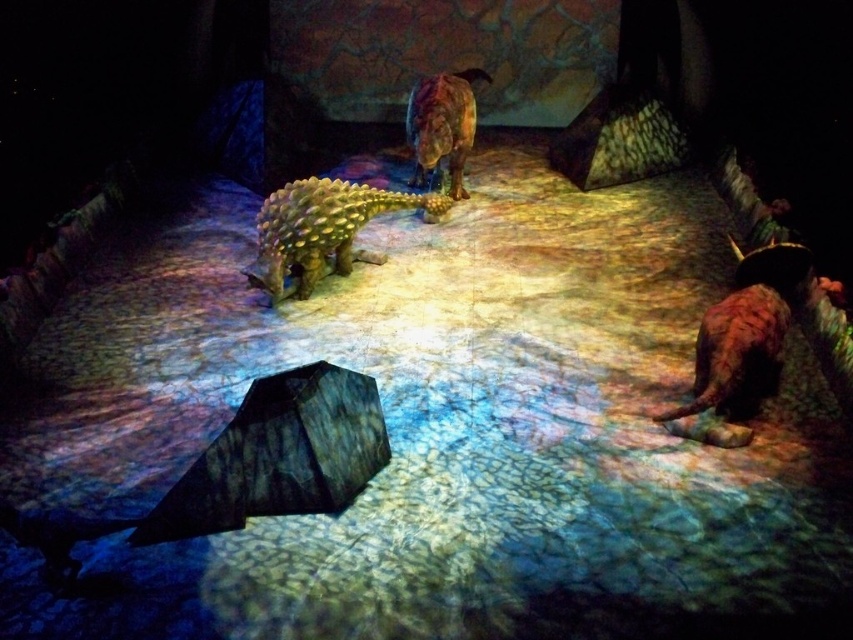
Question: Observing the image, what is the correct spatial positioning of green scaly ankylosaurus at center in reference to shiny brown dinosaur at center?

Choices:
 (A) right
 (B) left

Answer: (B)

Question: Where is green scaly ankylosaurus at center located in relation to shiny brown dinosaur at center in the image?

Choices:
 (A) right
 (B) left

Answer: (B)

Question: Based on their relative distances, which object is nearer to the green scaly ankylosaurus at center?

Choices:
 (A) shiny brown dinosaur at center
 (B) textured dark gray umbrella at center

Answer: (A)

Question: Which object appears closest to the camera in this image?

Choices:
 (A) shiny brown dinosaur at center
 (B) green scaly ankylosaurus at center

Answer: (B)

Question: Based on their relative distances, which object is nearer to the textured dark gray umbrella at center?

Choices:
 (A) shiny brown dinosaur at center
 (B) green scaly ankylosaurus at center

Answer: (B)

Question: Can you confirm if textured dark gray umbrella at center is positioned below green scaly ankylosaurus at center?

Choices:
 (A) yes
 (B) no

Answer: (A)